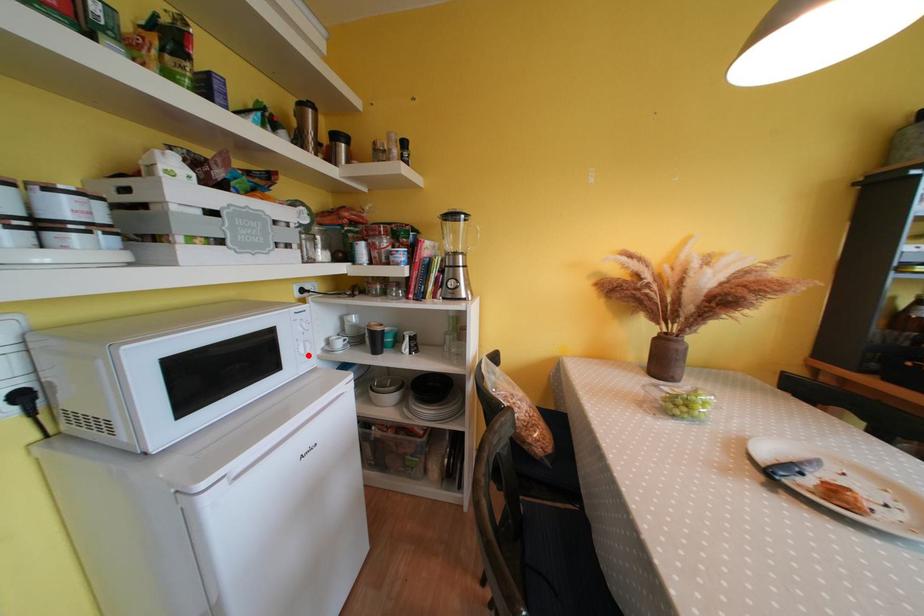
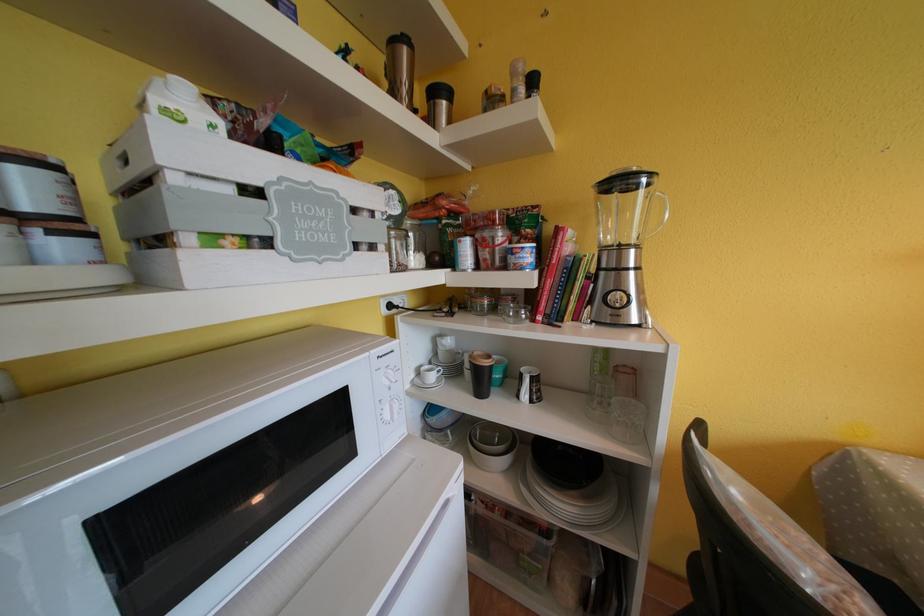
Find the pixel in the second image that matches the highlighted location in the first image.

(394, 421)